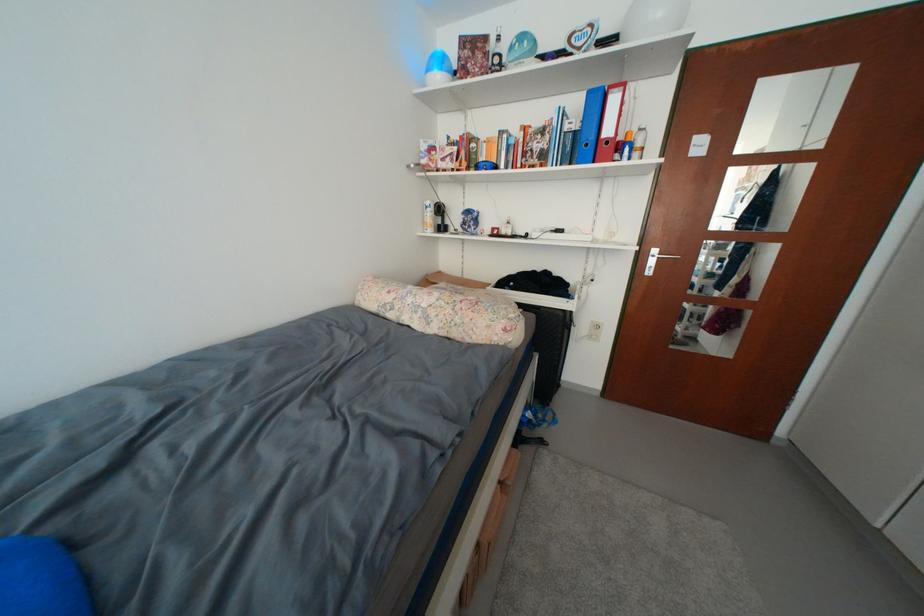
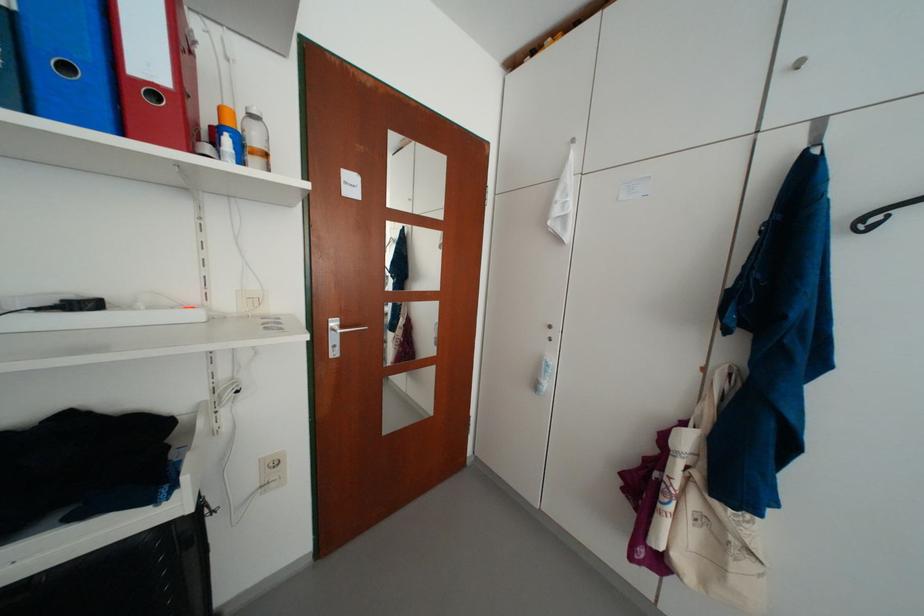
Locate, in the second image, the point that corresponds to [645,156] in the first image.

(263, 163)